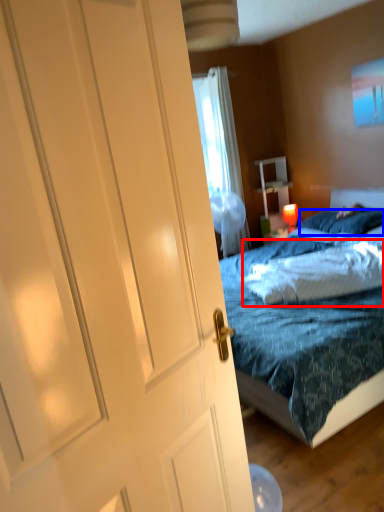
Question: Which object appears closest to the camera in this image, pillow (highlighted by a red box) or pillow (highlighted by a blue box)?

Choices:
 (A) pillow
 (B) pillow

Answer: (A)